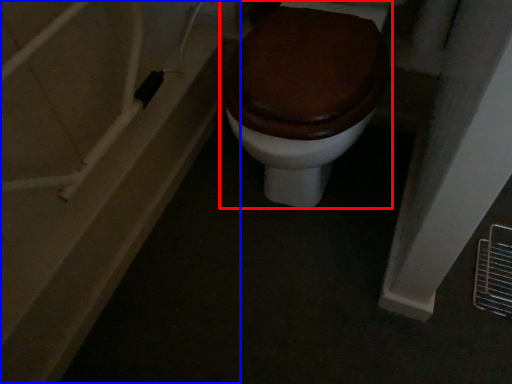
Question: Among these objects, which one is nearest to the camera, toilet (highlighted by a red box) or bath (highlighted by a blue box)?

Choices:
 (A) toilet
 (B) bath

Answer: (A)